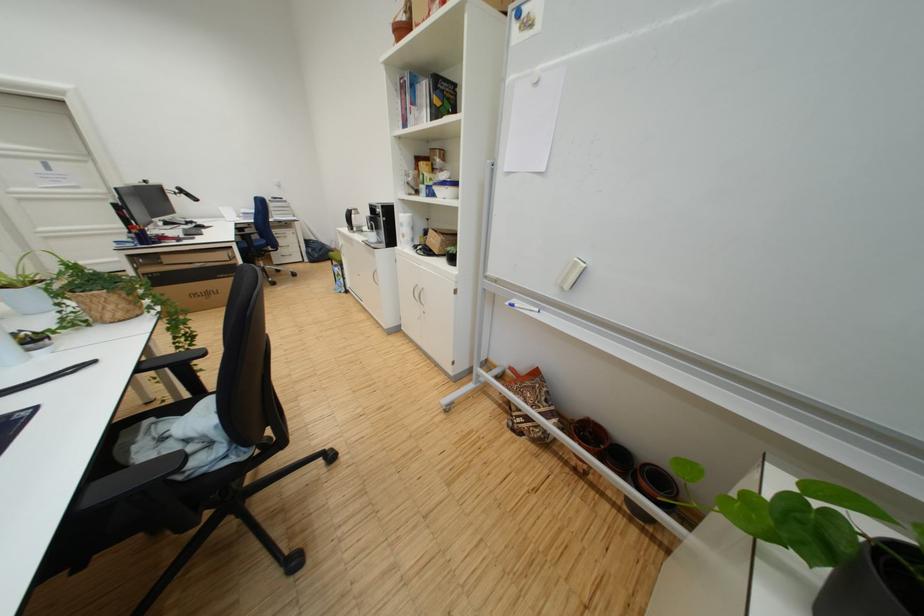
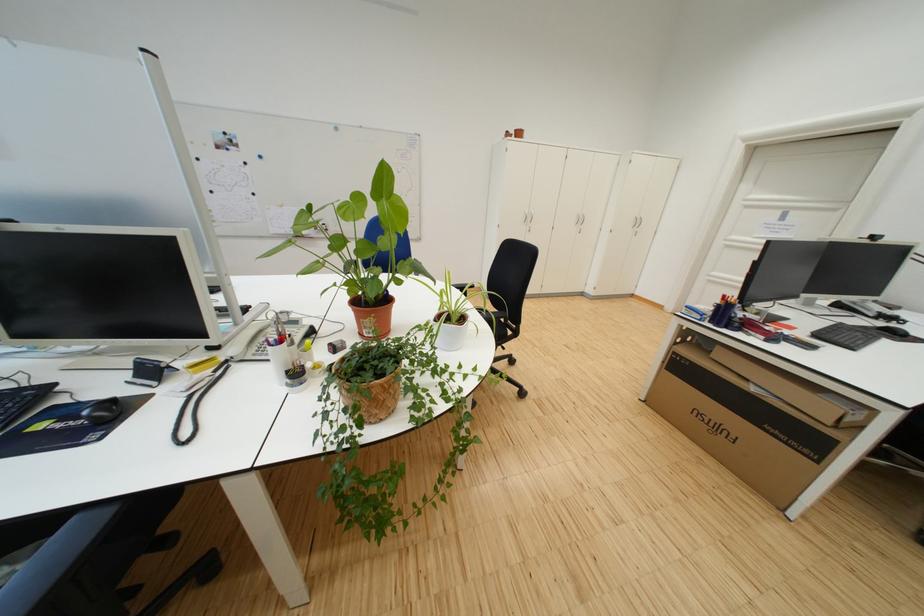
Find the pixel in the second image that matches (220,296) in the first image.

(730, 431)